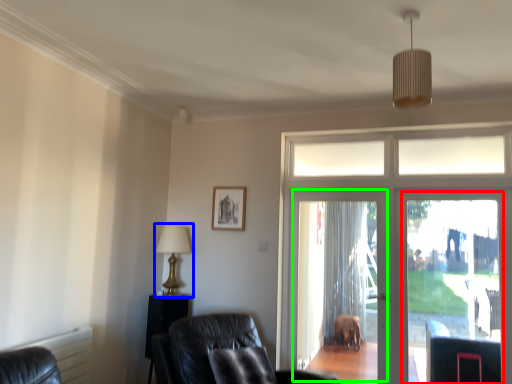
Question: Based on their relative distances, which object is nearer to screen door (highlighted by a red box)? Choose from table lamp (highlighted by a blue box) and screen door (highlighted by a green box).

Choices:
 (A) table lamp
 (B) screen door

Answer: (B)